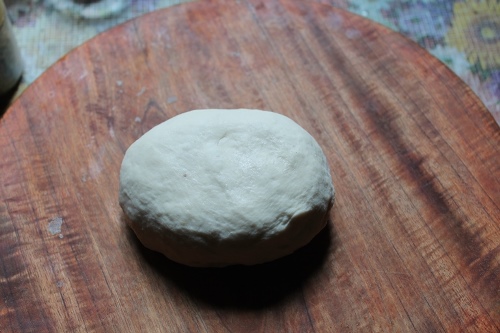
Find the location of a particular element. flower pattern on tablecloth is located at coordinates (26, 15).